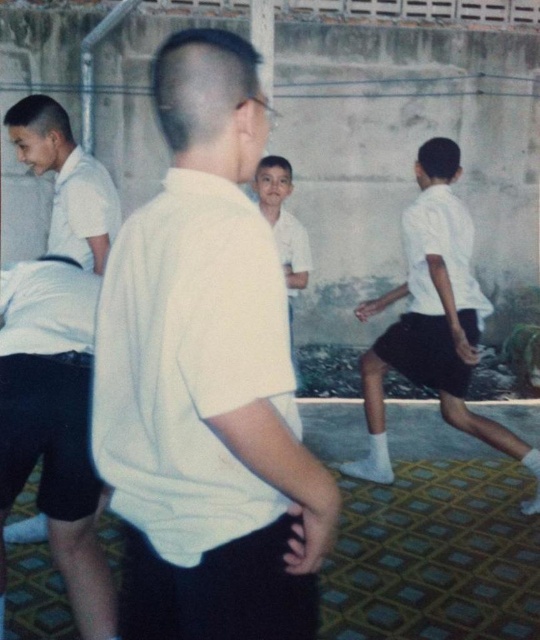
In the scene, you notice two participants wearing white shirts at the center. The man in the white matte shirt at center is standing still, while the other participant in the white smooth shirt at center is moving. Can you determine which shirt is bigger based on their positions?

The white matte shirt at center has a larger size compared to the white smooth shirt at center, so the stationary participant wearing the white matte shirt at center is wearing the bigger shirt.

You are a photographer standing at the back of the scene. You want to take a photo that includes both the white matte shirt at center and the white matte shirt at right. What is the minimum distance you need to move backward to ensure both are fully in frame?

The distance between the white matte shirt at center and the white matte shirt at right is 2.25 meters. To include both in the frame, you need to move back at least 2.25 meters so that the camera can capture the entire span between them.

You are a photographer trying to capture a group photo of the participants in the exercise session. You need to ensure that all participants are visible in the frame. Given that the white matte shirt at center is wider than the white smooth shirt at center, which participant should you position closer to the edge of the frame to avoid cropping?

The white matte shirt at center should be positioned closer to the edge of the frame because it is wider than the white smooth shirt at center, reducing the risk of cropping.